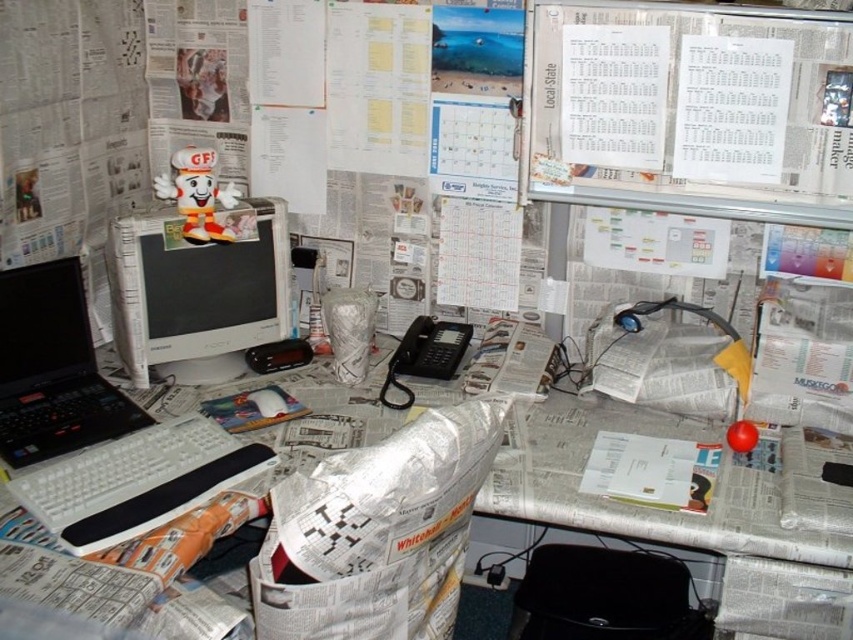
Question: Is whiteboard at upper right below matte plastic computer monitor at left?

Choices:
 (A) yes
 (B) no

Answer: (B)

Question: Can you confirm if white paper computer desk at center is smaller than black matte laptop at left?

Choices:
 (A) no
 (B) yes

Answer: (A)

Question: Is matte plastic computer monitor at left wider than black matte laptop at left?

Choices:
 (A) yes
 (B) no

Answer: (A)

Question: Which object appears closest to the camera in this image?

Choices:
 (A) whiteboard at upper right
 (B) matte plastic computer monitor at left
 (C) white paper computer desk at center
 (D) white plastic keyboard at lower left

Answer: (D)

Question: Which object is positioned farthest from the black matte laptop at left?

Choices:
 (A) matte plastic computer monitor at left
 (B) white paper computer desk at center
 (C) whiteboard at upper right

Answer: (C)

Question: Among these objects, which one is nearest to the camera?

Choices:
 (A) whiteboard at upper right
 (B) white paper computer desk at center

Answer: (B)